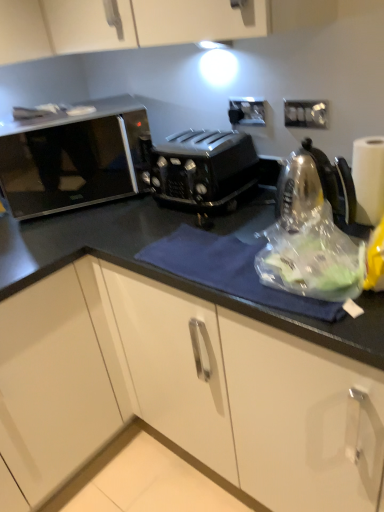
Question: Would you say white paper at right is to the left or to the right of sleek black microwave at left in the picture?

Choices:
 (A) right
 (B) left

Answer: (A)

Question: In terms of size, does white paper at right appear bigger or smaller than sleek black microwave at left?

Choices:
 (A) big
 (B) small

Answer: (B)

Question: Which object is the farthest from the white plastic electric outlet at upper right, the 2th electric outlet when ordered from back to front?

Choices:
 (A) black plastic toaster at center
 (B) white paper at right
 (C) black plastic electric outlet at upper center, acting as the first electric outlet starting from the left
 (D) sleek black microwave at left

Answer: (D)

Question: Which of these objects is positioned closest to the sleek black microwave at left?

Choices:
 (A) black plastic toaster at center
 (B) black plastic electric outlet at upper center, which is the second electric outlet from front to back
 (C) white plastic electric outlet at upper right, the 2th electric outlet when ordered from back to front
 (D) white paper at right

Answer: (A)